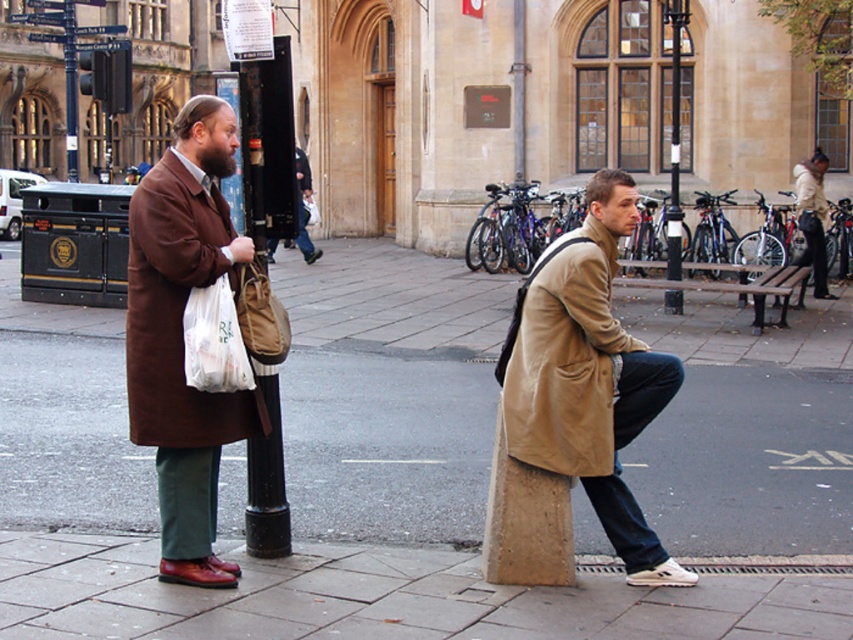
You are a tailor who needs to determine if a new coat can fit into a coat rack that has a maximum width capacity of 40 cm. You observe the brown wool coat at left and the black metal pole at upper center. Which object can you use to estimate the coat width? Explain your reasoning based on their sizes.

The brown wool coat at left is wider than the black metal pole at upper center. Since the coat is wider, if the pole is narrower than 40 cm, the coat might exceed the rack capacity. However, without knowing the pole width, you cannot accurately determine if the coat fits. You need to measure the pole first to estimate the coat width.

You are a tailor who needs to determine which coat requires more fabric to alter. Based on the image, which coat would need more fabric, the brown wool coat at left or the tan suede coat at lower right?

The brown wool coat at left requires more fabric for alterations since it is larger in size than the tan suede coat at lower right.

You are a photographer trying to capture the brown wool coat at left in your shot. According to the coordinates provided, where should you position your camera to ensure the coat is centered in the frame?

The brown wool coat at left is located at coordinates point (177, 314), so positioning the camera to center the frame at that point will ensure the coat is centered.